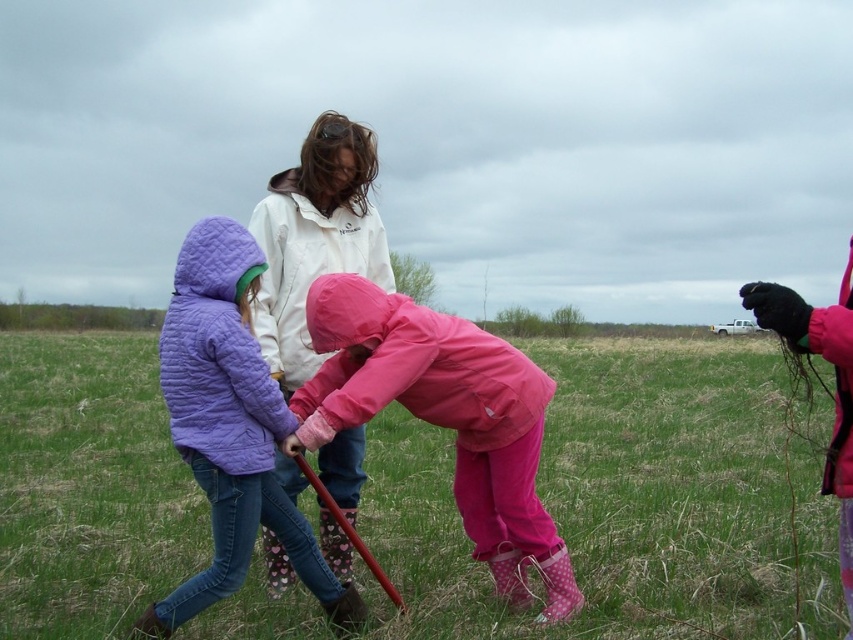
Locate an element on the screen. green grass at center is located at coordinates (607, 499).

Between point (450, 492) and point (196, 428), which one is positioned in front?

Point (196, 428) is more forward.

Find the location of a particular element. green grass at center is located at coordinates (607, 499).

Find the location of `green grass at center`. green grass at center is located at coordinates (607, 499).

Looking at this image, can you confirm if pink matte raincoat at center is positioned below quilted purple jacket at center?

Indeed, pink matte raincoat at center is positioned under quilted purple jacket at center.

Does pink matte raincoat at center have a lesser width compared to quilted purple jacket at center?

In fact, pink matte raincoat at center might be wider than quilted purple jacket at center.

Does point (532, 502) come farther from viewer compared to point (254, 349)?

Yes, point (532, 502) is behind point (254, 349).

Where is `pink matte raincoat at center`? Image resolution: width=853 pixels, height=640 pixels. pink matte raincoat at center is located at coordinates (444, 419).

Which of these two, green grass at center or pink matte raincoat at center, stands taller?

With more height is pink matte raincoat at center.

Is green grass at center positioned before pink matte raincoat at center?

No, green grass at center is further to the viewer.

Which is behind, point (706, 544) or point (531, 548)?

The point (706, 544) is more distant.

This screenshot has height=640, width=853. Find the location of `green grass at center`. green grass at center is located at coordinates (607, 499).